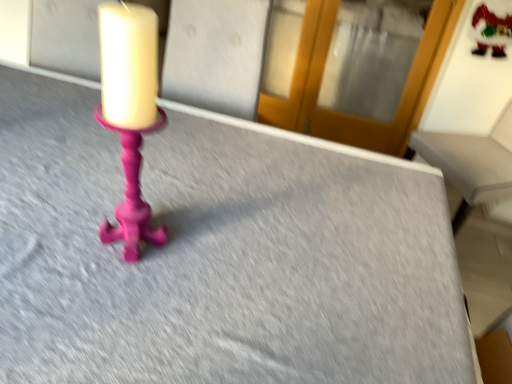
Question: Considering the positions of frosted glass santa claus at upper right and transparent glass door at upper center in the image, is frosted glass santa claus at upper right bigger or smaller than transparent glass door at upper center?

Choices:
 (A) big
 (B) small

Answer: (B)

Question: Considering their positions, is frosted glass santa claus at upper right located in front of or behind transparent glass door at upper center?

Choices:
 (A) behind
 (B) front

Answer: (B)

Question: Is point (509, 28) positioned closer to the camera than point (309, 0)?

Choices:
 (A) farther
 (B) closer

Answer: (B)

Question: Is transparent glass door at upper center taller or shorter than frosted glass santa claus at upper right?

Choices:
 (A) short
 (B) tall

Answer: (B)

Question: In the image, is transparent glass door at upper center on the left side or the right side of frosted glass santa claus at upper right?

Choices:
 (A) right
 (B) left

Answer: (B)

Question: From the image's perspective, relative to frosted glass santa claus at upper right, is transparent glass door at upper center above or below?

Choices:
 (A) above
 (B) below

Answer: (A)

Question: Considering the positions of transparent glass door at upper center and frosted glass santa claus at upper right in the image, is transparent glass door at upper center wider or thinner than frosted glass santa claus at upper right?

Choices:
 (A) thin
 (B) wide

Answer: (B)